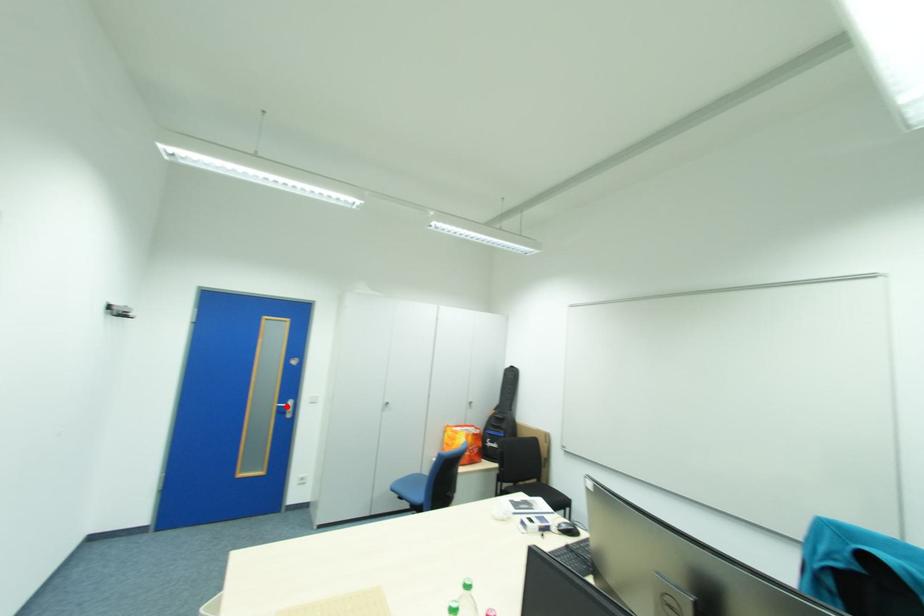
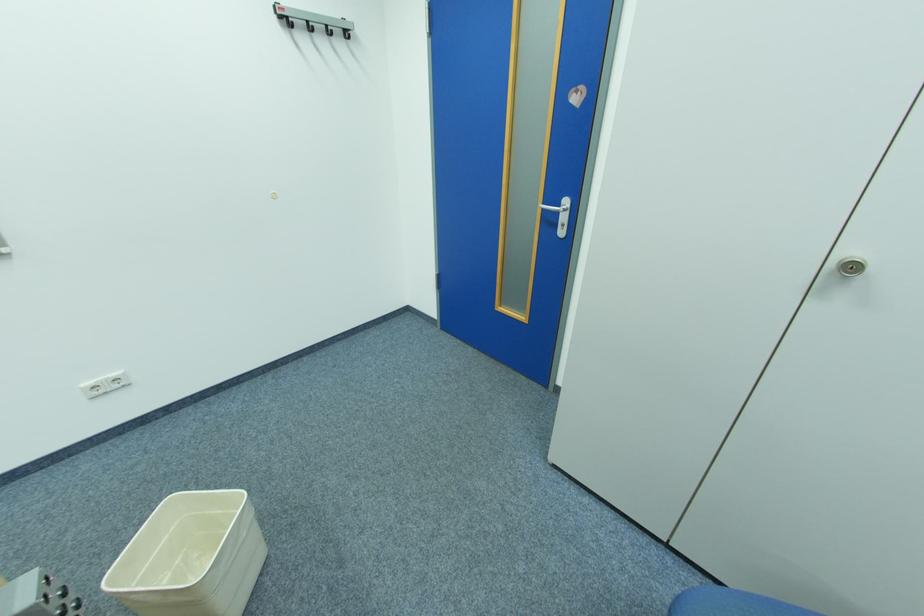
Find the pixel in the second image that matches the highlighted location in the first image.

(552, 209)